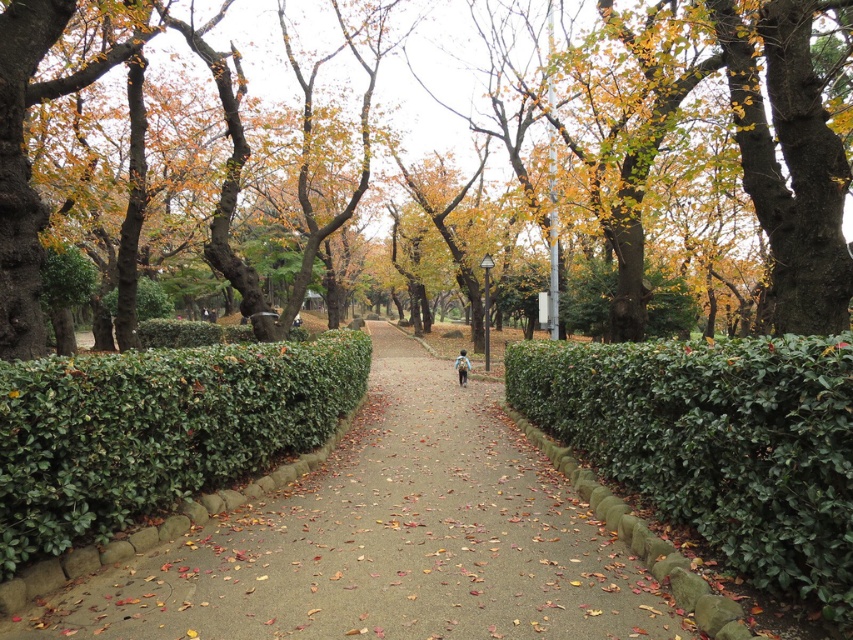
Question: Is green leafy hedge at right in front of brown textured tree at center?

Choices:
 (A) no
 (B) yes

Answer: (B)

Question: Estimate the real-world distances between objects in this image. Which object is farther from the green leafy hedge at right?

Choices:
 (A) green concrete pavement at center
 (B) brown fabric backpack at center
 (C) green leafy hedge at lower left

Answer: (B)

Question: Among these points, which one is nearest to the camera?

Choices:
 (A) [74, 541]
 (B) [462, 381]
 (C) [308, 579]
 (D) [7, 221]

Answer: (C)

Question: Is green leafy hedge at right positioned at the back of brown textured tree at center?

Choices:
 (A) yes
 (B) no

Answer: (B)

Question: Which object is positioned farthest from the green leafy hedge at lower left?

Choices:
 (A) green leafy hedge at right
 (B) brown fabric backpack at center
 (C) green concrete pavement at center
 (D) brown textured tree at center

Answer: (B)

Question: Is brown textured tree at center below brown fabric backpack at center?

Choices:
 (A) no
 (B) yes

Answer: (A)